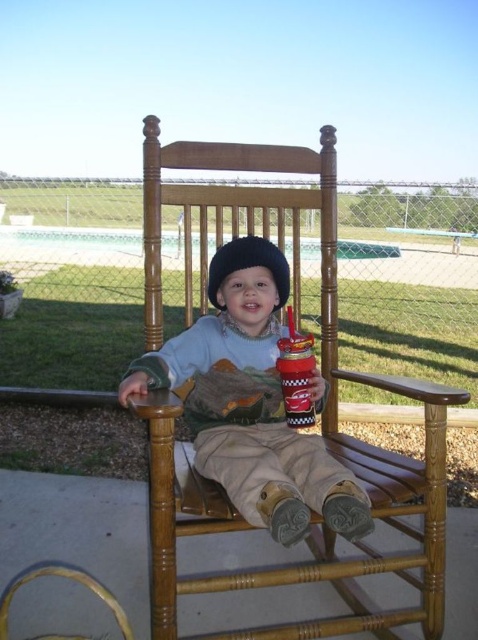
Question: Does matte plastic toddler at center lie in front of fuzzy black hat at center?

Choices:
 (A) yes
 (B) no

Answer: (A)

Question: Which of the following is the closest to the observer?

Choices:
 (A) (152, 164)
 (B) (267, 378)

Answer: (B)

Question: Can you confirm if wooden rocking chair at center is positioned below matte plastic toddler at center?

Choices:
 (A) no
 (B) yes

Answer: (A)

Question: Which of the following is the farthest from the observer?

Choices:
 (A) pyautogui.click(x=271, y=440)
 (B) pyautogui.click(x=345, y=596)
 (C) pyautogui.click(x=278, y=291)

Answer: (B)

Question: Which object is farther from the camera taking this photo?

Choices:
 (A) fuzzy black hat at center
 (B) matte plastic toddler at center
 (C) wooden rocking chair at center

Answer: (A)

Question: Is matte plastic toddler at center closer to the viewer compared to fuzzy black hat at center?

Choices:
 (A) yes
 (B) no

Answer: (A)